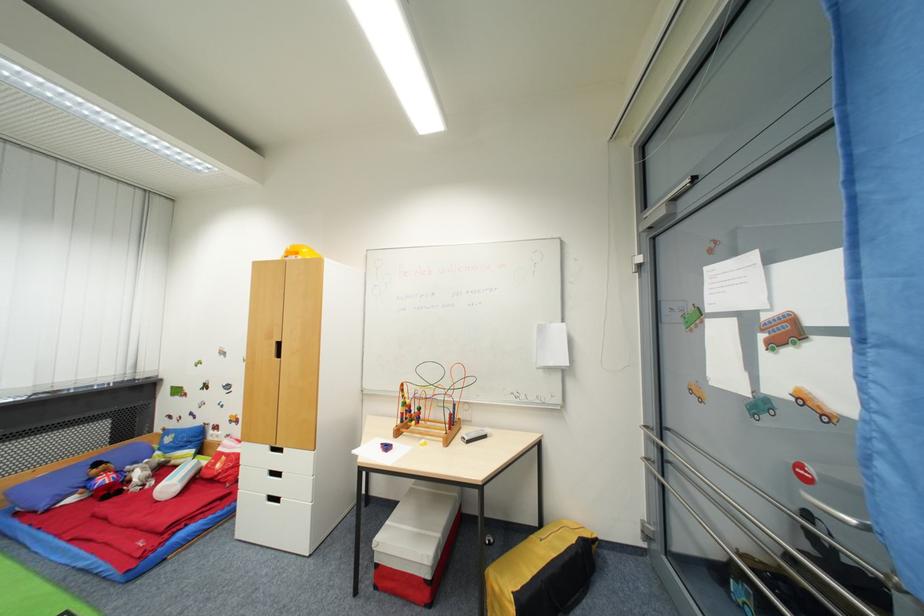
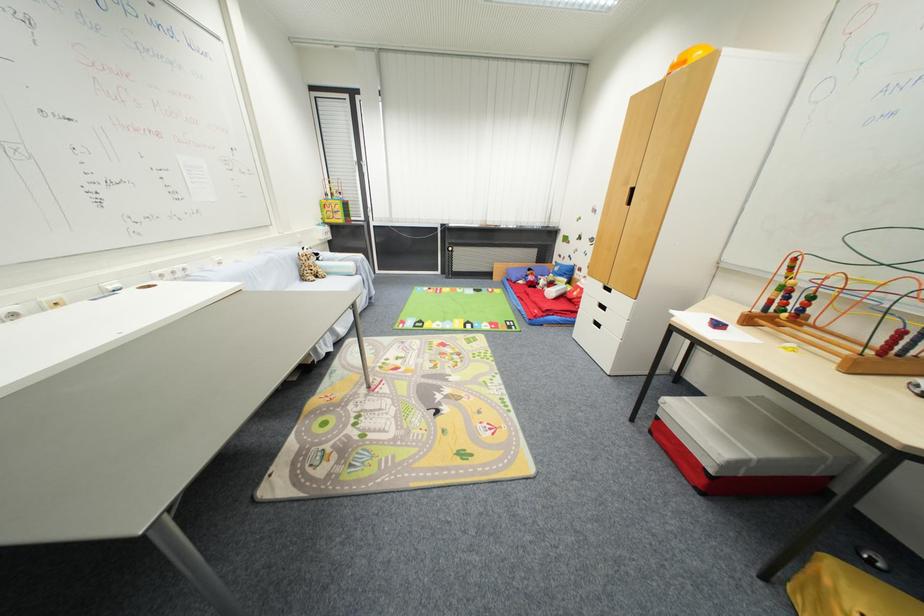
In the second image, find the point that corresponds to point 272,476 in the first image.

(602, 306)